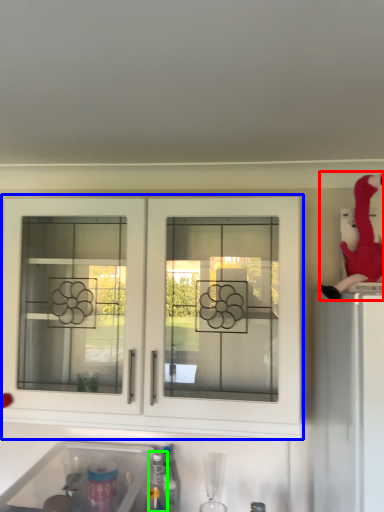
Question: Which is nearer to the person (highlighted by a red box)? cabinetry (highlighted by a blue box) or bottle (highlighted by a green box).

Choices:
 (A) cabinetry
 (B) bottle

Answer: (A)